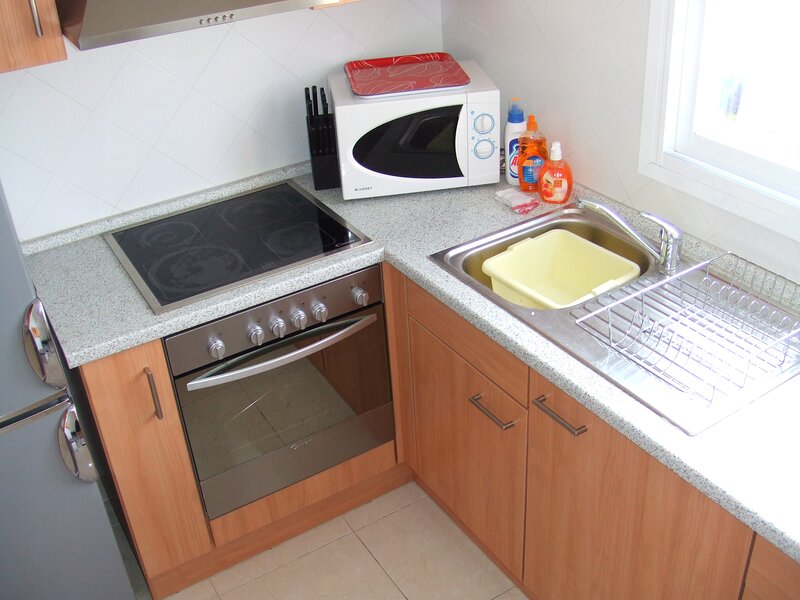
Where is `oven knob 2`? oven knob 2 is located at coordinates (256, 335).